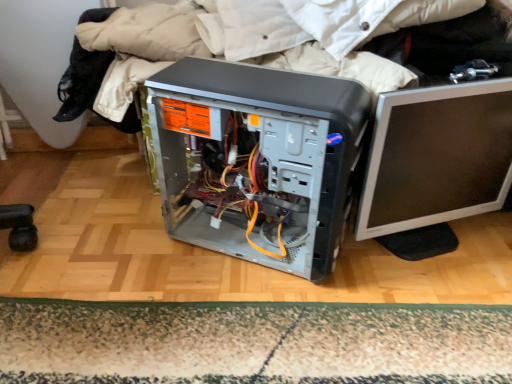
Find the location of a particular element. The width and height of the screenshot is (512, 384). free area below carpeted mat at lower center (from a real-world perspective) is located at coordinates (276, 344).